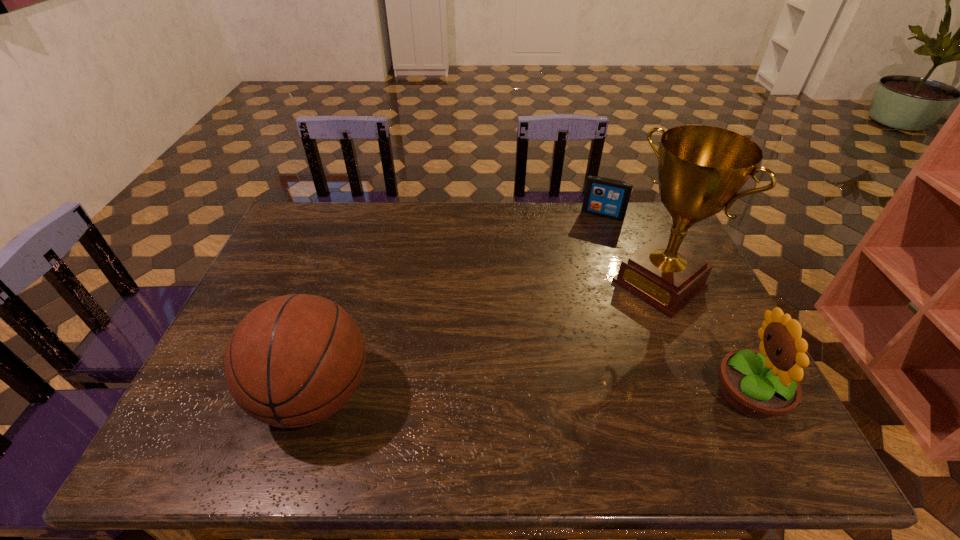
This screenshot has width=960, height=540. What are the coordinates of `vacant area situated 0.330m on the face of the sunflower` in the screenshot? It's located at (571, 395).

The width and height of the screenshot is (960, 540). Identify the location of free spot located 0.130m on the face of the sunflower. (657, 395).

Identify the location of vacant position located on the front screen of the iPod. The height and width of the screenshot is (540, 960). (584, 251).

Find the location of a particular element. Image resolution: width=960 pixels, height=540 pixels. free space located on the front screen of the iPod is located at coordinates (574, 272).

Where is `free space located on the front screen of the iPod`? free space located on the front screen of the iPod is located at coordinates (572, 279).

Locate an element on the screen. Image resolution: width=960 pixels, height=540 pixels. free region located 0.060m on the plaque of the second farthest object is located at coordinates (618, 316).

The height and width of the screenshot is (540, 960). Identify the location of blank space located 0.290m on the plaque of the second farthest object. (561, 360).

Image resolution: width=960 pixels, height=540 pixels. I want to click on vacant space located 0.340m on the plaque of the second farthest object, so click(x=547, y=371).

Identify the location of object at the far edge. (604, 197).

In order to click on basketball that is positioned at the near edge in this screenshot , I will do `click(293, 361)`.